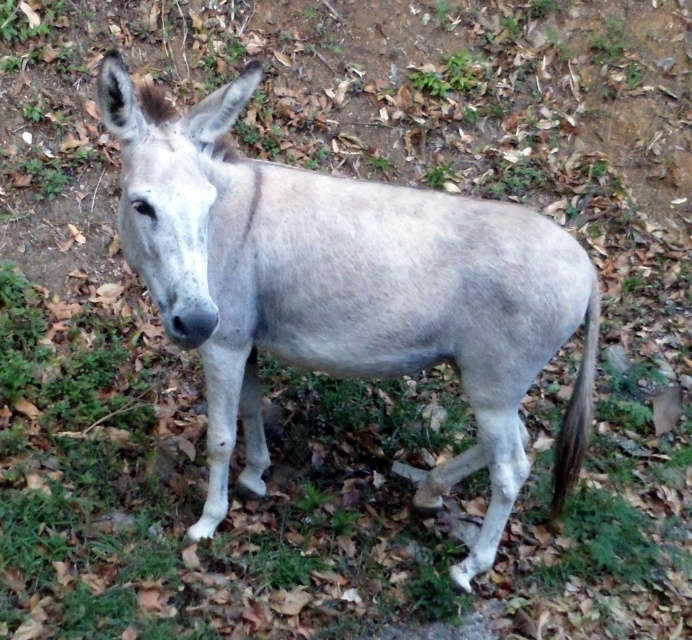
This screenshot has width=692, height=640. What do you see at coordinates (346, 291) in the screenshot? I see `gray matte mule at center` at bounding box center [346, 291].

Which is in front, point (230, 433) or point (556, 444)?

Point (230, 433) is in front.

The width and height of the screenshot is (692, 640). What are the coordinates of `gray matte mule at center` in the screenshot? It's located at (346, 291).